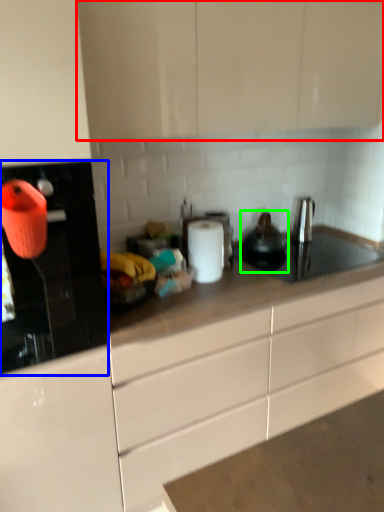
Question: Which object is the farthest from cabinetry (highlighted by a red box)? Choose among these: kitchen appliance (highlighted by a blue box) or tea pot (highlighted by a green box).

Choices:
 (A) kitchen appliance
 (B) tea pot

Answer: (B)